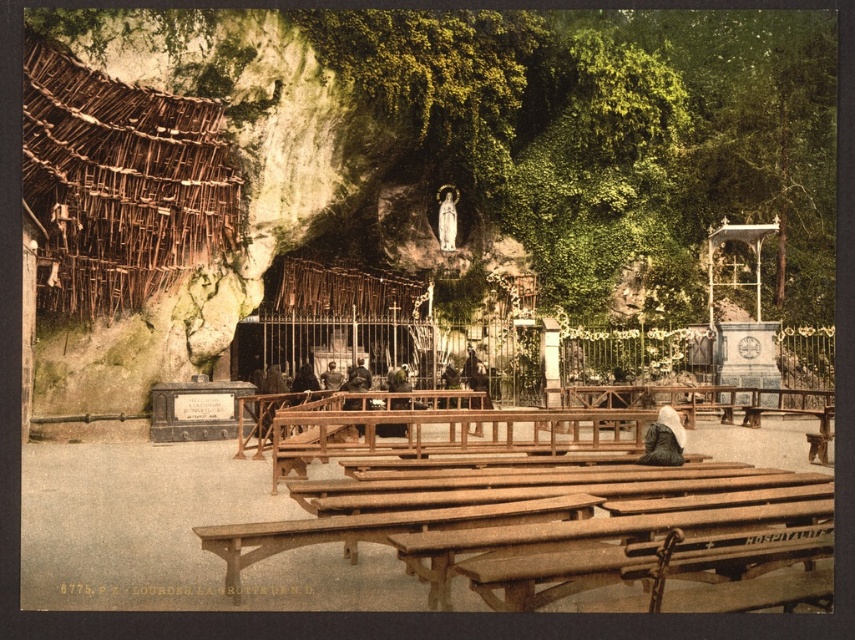
Question: Which point is farther from the camera taking this photo?

Choices:
 (A) (445, 188)
 (B) (423, 572)

Answer: (A)

Question: Observing the image, what is the correct spatial positioning of wooden park bench at lower center in reference to white statue at center?

Choices:
 (A) above
 (B) below

Answer: (B)

Question: Which point appears closest to the camera in this image?

Choices:
 (A) (440, 218)
 (B) (322, 381)

Answer: (B)

Question: Which of these objects is positioned farthest from the wooden picnic table at center?

Choices:
 (A) white statue at center
 (B) wooden park bench at lower center
 (C) dark brown leather jacket at center

Answer: (A)

Question: Is wooden picnic table at center bigger than wooden park bench at lower center?

Choices:
 (A) no
 (B) yes

Answer: (B)

Question: Can you confirm if wooden picnic table at center is positioned to the left of wooden park bench at lower center?

Choices:
 (A) no
 (B) yes

Answer: (B)